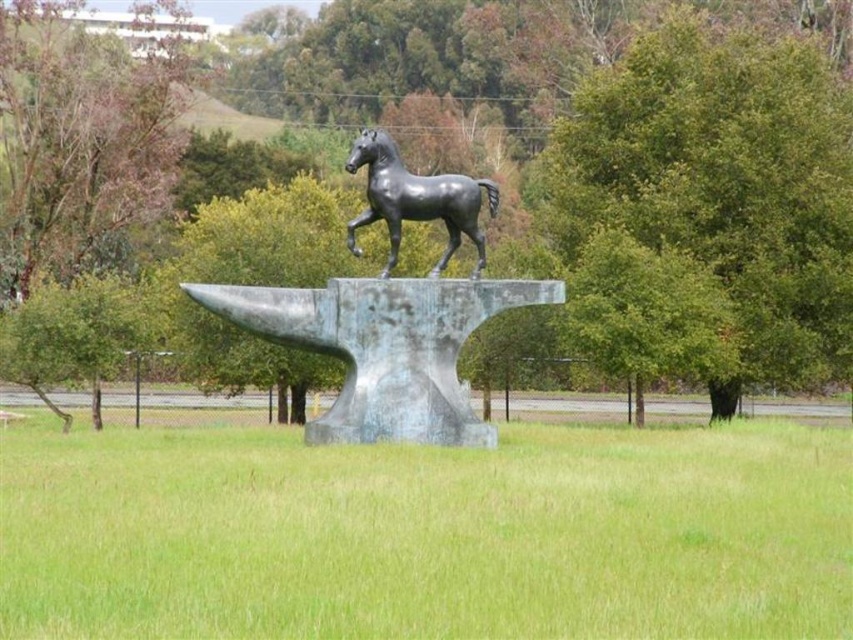
Between green grass at center and bronze horse at center, which one appears on the left side from the viewer's perspective?

bronze horse at center is more to the left.

Who is more forward, (763,561) or (375,440)?

Point (763,561)

The width and height of the screenshot is (853, 640). Identify the location of green grass at center. (427, 534).

Locate an element on the screen. green grass at center is located at coordinates (427, 534).

Which is above, bronze horse at center or polished bronze horse at center?

polished bronze horse at center is higher up.

From the picture: Who is more distant from viewer, [376,307] or [372,202]?

The point [372,202] is behind.

The width and height of the screenshot is (853, 640). What do you see at coordinates (392, 312) in the screenshot?
I see `bronze horse at center` at bounding box center [392, 312].

The height and width of the screenshot is (640, 853). I want to click on bronze horse at center, so click(x=392, y=312).

Who is positioned more to the right, green grass at center or polished bronze horse at center?

Positioned to the right is polished bronze horse at center.

Does point (337, 492) come behind point (386, 204)?

That is False.

Is point (234, 492) positioned before point (354, 220)?

Yes.

You are a GUI agent. You are given a task and a screenshot of the screen. Output one action in this format:
    pyautogui.click(x=<x>, y=<y>)
    Task: Click on the green grass at center
    
    Given the screenshot: What is the action you would take?
    pyautogui.click(x=427, y=534)